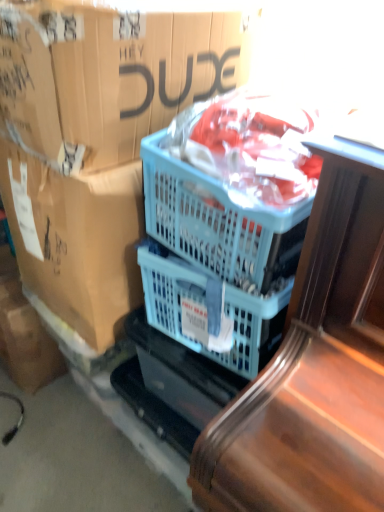
What do you see at coordinates (96, 139) in the screenshot? Image resolution: width=384 pixels, height=512 pixels. I see `brown cardboard at left` at bounding box center [96, 139].

Find the location of a particular element. The width and height of the screenshot is (384, 512). brown cardboard at left is located at coordinates (96, 139).

Find the location of a particular element. This screenshot has width=384, height=512. brown cardboard at left is located at coordinates (96, 139).